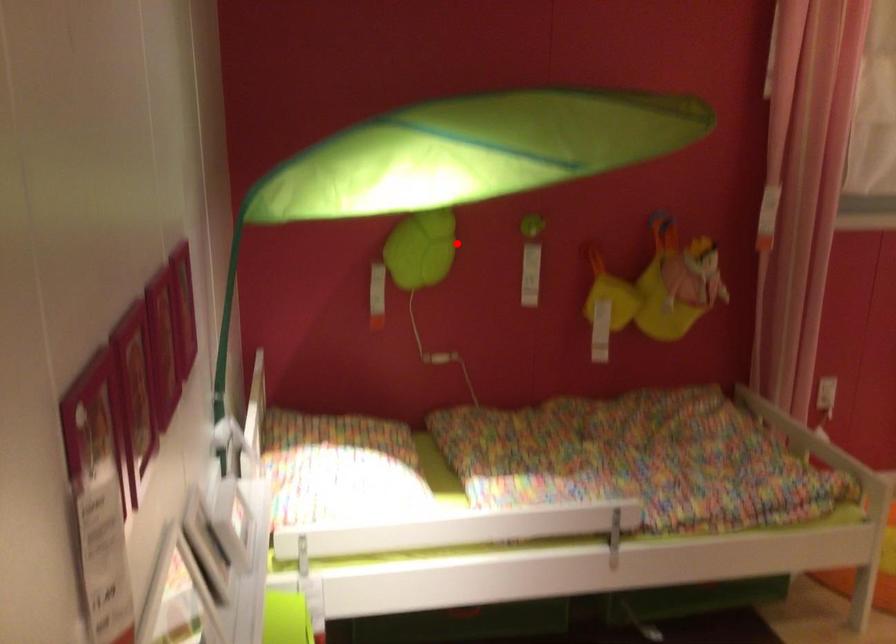
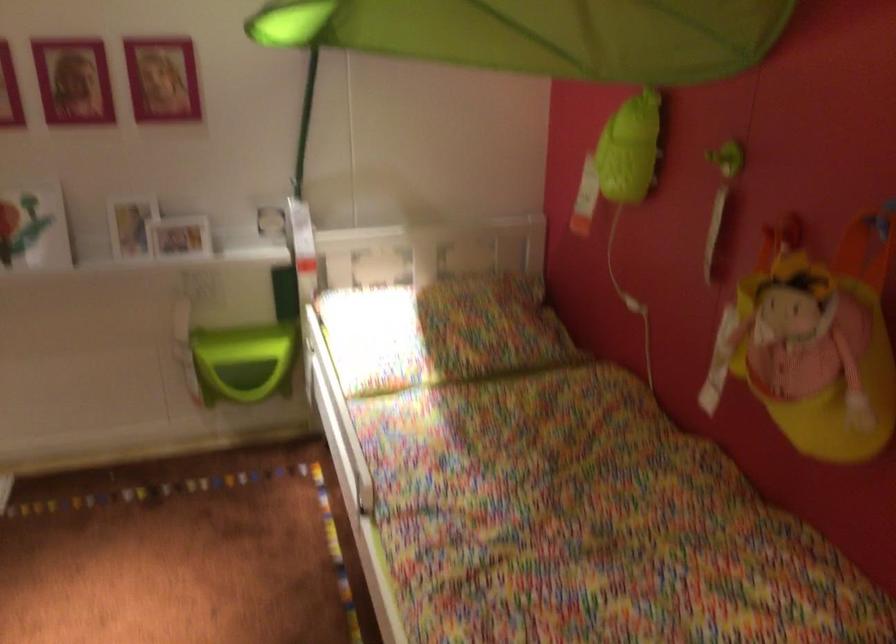
Question: I am providing you with two images of the same scene from different viewpoints. Image1 has a red point marked. In image2, the corresponding 3D location appears at what relative position? Reply with the corresponding letter.

Choices:
 (A) Closer
 (B) Farther

Answer: (A)